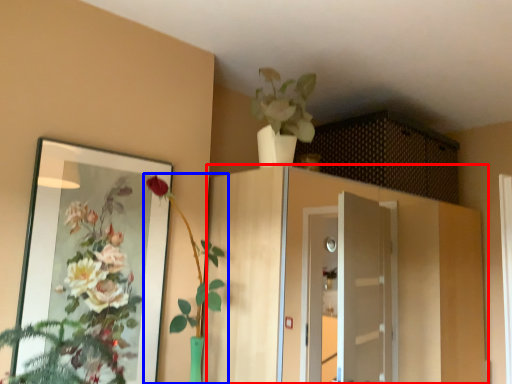
Question: Which of the following is the farthest to the observer, cabinetry (highlighted by a red box) or houseplant (highlighted by a blue box)?

Choices:
 (A) cabinetry
 (B) houseplant

Answer: (A)